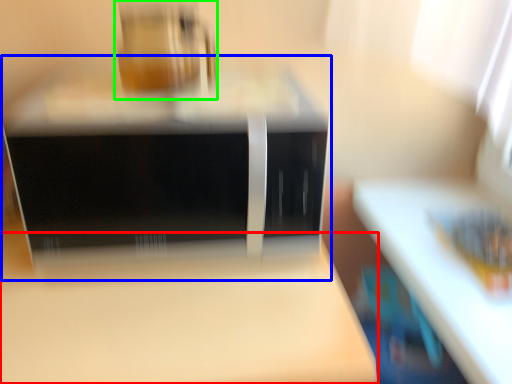
Question: Which object is positioned closest to table (highlighted by a red box)? Select from home appliance (highlighted by a blue box) and appliance (highlighted by a green box).

Choices:
 (A) home appliance
 (B) appliance

Answer: (A)